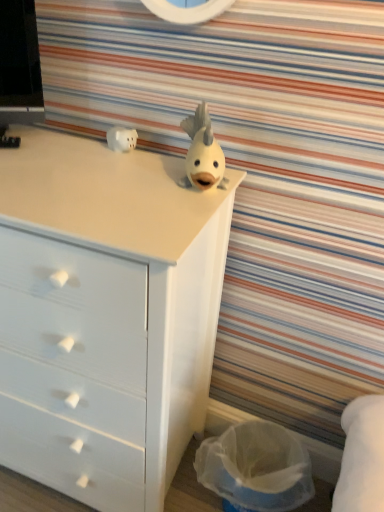
You are a GUI agent. You are given a task and a screenshot of the screen. Output one action in this format:
    pyautogui.click(x=<x>, y=<y>)
    Task: Click on the vacant space that is to the left of white matte piggy bank at upper left, the 1th toy in the left-to-right sequence
    Image resolution: width=384 pixels, height=512 pixels.
    Given the screenshot: What is the action you would take?
    pyautogui.click(x=64, y=147)